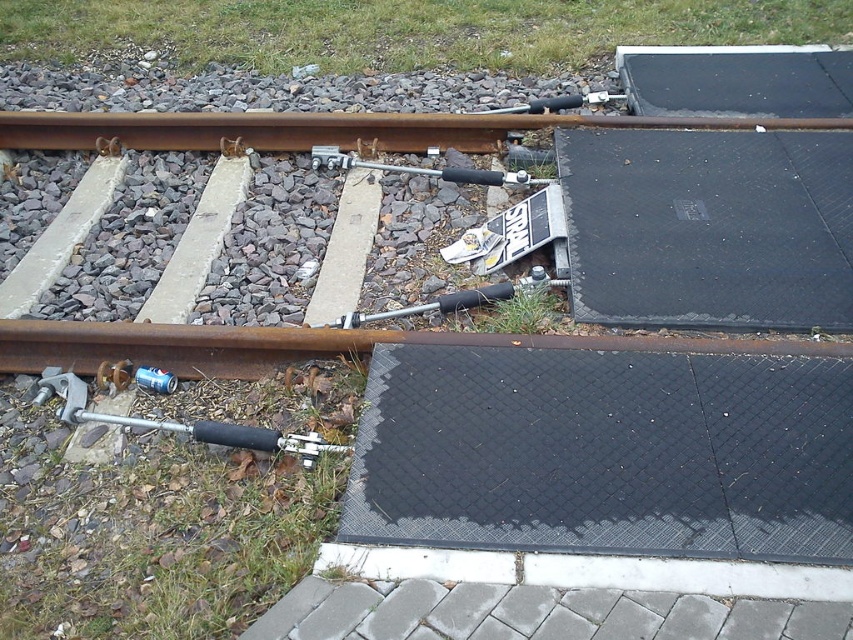
Looking at this image, you are a maintenance worker inspecting the railway tracks. You see the rusty metal train track at lower center and the metallic silver tool at lower left. Which object is longer?

The metallic silver tool at lower left is longer than the rusty metal train track at lower center.

You are a railway inspector checking the alignment of the tracks. You observe the rusty metal train track at lower center and the rusty metal train track at upper center. Which track is positioned to the right of the other?

→ The rusty metal train track at lower center is to the right of the rusty metal train track at upper center.